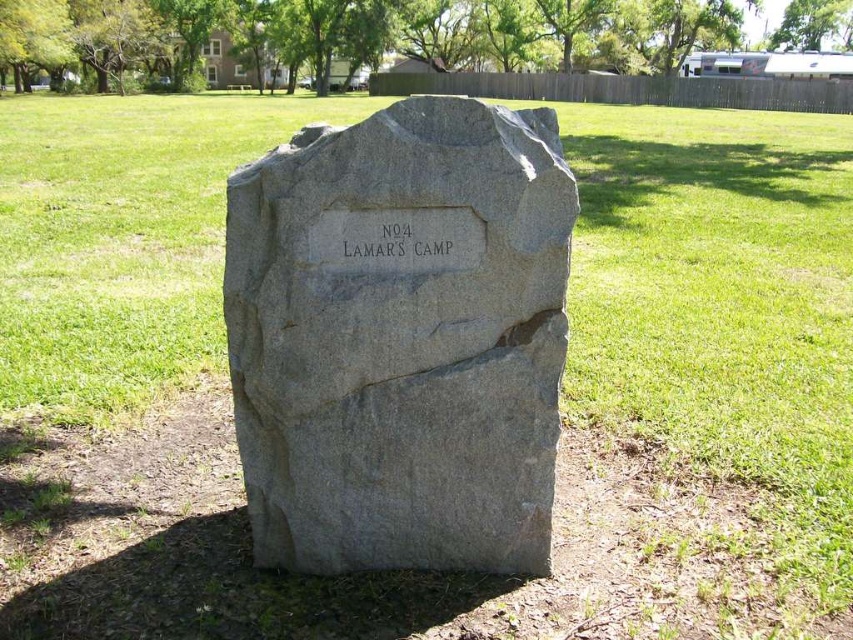
Question: Can you confirm if gray stone marker at center is positioned to the left of black stone engraving at center?

Choices:
 (A) no
 (B) yes

Answer: (B)

Question: Which of the following is the closest to the observer?

Choices:
 (A) gray stone marker at center
 (B) black stone engraving at center

Answer: (A)

Question: Among these objects, which one is farthest from the camera?

Choices:
 (A) gray stone marker at center
 (B) black stone engraving at center

Answer: (B)

Question: Does gray stone marker at center have a smaller size compared to black stone engraving at center?

Choices:
 (A) no
 (B) yes

Answer: (A)

Question: Among these points, which one is farthest from the camera?

Choices:
 (A) (489, 125)
 (B) (445, 260)

Answer: (B)

Question: In this image, where is gray stone marker at center located relative to black stone engraving at center?

Choices:
 (A) above
 (B) below

Answer: (B)